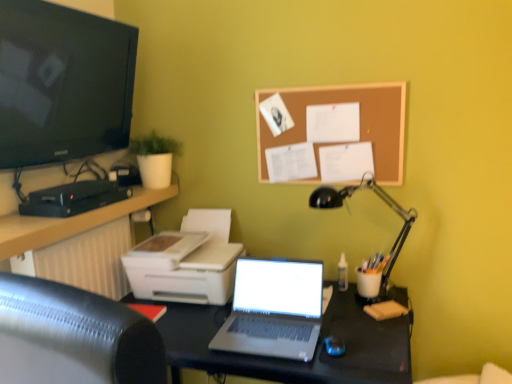
Question: Considering the relative sizes of black metal desk lamp at right and white plastic printer at lower left in the image provided, is black metal desk lamp at right shorter than white plastic printer at lower left?

Choices:
 (A) no
 (B) yes

Answer: (A)

Question: Is black metal desk lamp at right far from white plastic printer at lower left?

Choices:
 (A) no
 (B) yes

Answer: (A)

Question: Is black metal desk lamp at right smaller than white plastic printer at lower left?

Choices:
 (A) no
 (B) yes

Answer: (B)

Question: Does black metal desk lamp at right lie in front of white plastic printer at lower left?

Choices:
 (A) no
 (B) yes

Answer: (B)

Question: Considering the relative sizes of black metal desk lamp at right and white plastic printer at lower left in the image provided, is black metal desk lamp at right wider than white plastic printer at lower left?

Choices:
 (A) no
 (B) yes

Answer: (A)

Question: Is point (98, 49) closer or farther from the camera than point (338, 205)?

Choices:
 (A) farther
 (B) closer

Answer: (B)

Question: Considering their positions, is black glossy screen at upper left located in front of or behind black metal desk lamp at right?

Choices:
 (A) front
 (B) behind

Answer: (A)

Question: Is black glossy screen at upper left spatially inside black metal desk lamp at right, or outside of it?

Choices:
 (A) inside
 (B) outside

Answer: (B)

Question: Based on their positions, is black glossy screen at upper left located to the left or right of black metal desk lamp at right?

Choices:
 (A) left
 (B) right

Answer: (A)

Question: From their relative heights in the image, would you say silver metallic laptop at center is taller or shorter than matte black entertainment center at left?

Choices:
 (A) short
 (B) tall

Answer: (A)

Question: From a real-world perspective, relative to matte black entertainment center at left, is silver metallic laptop at center vertically above or below?

Choices:
 (A) above
 (B) below

Answer: (B)

Question: Considering their positions, is silver metallic laptop at center located in front of or behind matte black entertainment center at left?

Choices:
 (A) behind
 (B) front

Answer: (A)

Question: From the image's perspective, is silver metallic laptop at center located above or below matte black entertainment center at left?

Choices:
 (A) above
 (B) below

Answer: (A)

Question: Considering their positions, is black glossy screen at upper left located in front of or behind white plastic printer at lower left?

Choices:
 (A) front
 (B) behind

Answer: (A)

Question: Is black glossy screen at upper left situated inside white plastic printer at lower left or outside?

Choices:
 (A) inside
 (B) outside

Answer: (B)